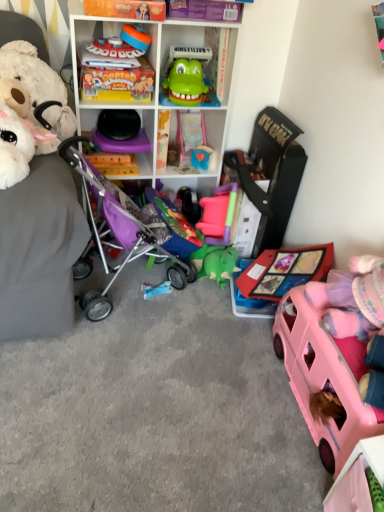
Question: Considering the relative positions of blue matte toy at center, the second toy viewed from the right, and pink plastic car at lower right, positioned as the 7th toy in left-to-right order, in the image provided, is blue matte toy at center, the second toy viewed from the right, to the left of pink plastic car at lower right, positioned as the 7th toy in left-to-right order, from the viewer's perspective?

Choices:
 (A) yes
 (B) no

Answer: (A)

Question: Considering the relative sizes of blue matte toy at center, the second toy viewed from the right, and pink plastic car at lower right, which is the 1th toy in right-to-left order, in the image provided, is blue matte toy at center, the second toy viewed from the right, smaller than pink plastic car at lower right, which is the 1th toy in right-to-left order,?

Choices:
 (A) no
 (B) yes

Answer: (B)

Question: From the image's perspective, is blue matte toy at center, the second toy viewed from the right, on pink plastic car at lower right, positioned as the 7th toy in left-to-right order?

Choices:
 (A) yes
 (B) no

Answer: (A)

Question: From the image's perspective, does blue matte toy at center, which appears as the sixth toy when viewed from the left, appear lower than pink plastic car at lower right, which is the 1th toy in right-to-left order?

Choices:
 (A) yes
 (B) no

Answer: (B)

Question: Is the depth of blue matte toy at center, which appears as the sixth toy when viewed from the left, less than that of pink plastic car at lower right, which is the 1th toy in right-to-left order?

Choices:
 (A) no
 (B) yes

Answer: (A)

Question: Is plastic toy car at center, the 4th toy in the left-to-right sequence, situated inside matte yellow book at upper center or outside?

Choices:
 (A) outside
 (B) inside

Answer: (A)

Question: Is plastic toy car at center, the 4th toy in the left-to-right sequence, in front of or behind matte yellow book at upper center in the image?

Choices:
 (A) front
 (B) behind

Answer: (B)

Question: Is plastic toy car at center, the 4th toy in the left-to-right sequence, wider or thinner than matte yellow book at upper center?

Choices:
 (A) thin
 (B) wide

Answer: (A)

Question: Considering the positions of plastic toy car at center, the 4th toy in the left-to-right sequence, and matte yellow book at upper center in the image, is plastic toy car at center, the 4th toy in the left-to-right sequence, taller or shorter than matte yellow book at upper center?

Choices:
 (A) tall
 (B) short

Answer: (B)

Question: Based on their positions, is matte yellow book at upper center located to the left or right of purple fabric baby carriage at left?

Choices:
 (A) right
 (B) left

Answer: (B)

Question: Is matte yellow book at upper center bigger or smaller than purple fabric baby carriage at left?

Choices:
 (A) big
 (B) small

Answer: (B)

Question: Looking at their shapes, would you say matte yellow book at upper center is wider or thinner than purple fabric baby carriage at left?

Choices:
 (A) wide
 (B) thin

Answer: (B)

Question: From a real-world perspective, is matte yellow book at upper center above or below purple fabric baby carriage at left?

Choices:
 (A) above
 (B) below

Answer: (A)

Question: From the image's perspective, is purple fabric baby carriage at left positioned above or below matte plastic game controller at upper center, which is the 6th toy in right-to-left order?

Choices:
 (A) above
 (B) below

Answer: (B)

Question: Would you say purple fabric baby carriage at left is inside or outside matte plastic game controller at upper center, the 2th toy in the left-to-right sequence?

Choices:
 (A) inside
 (B) outside

Answer: (B)